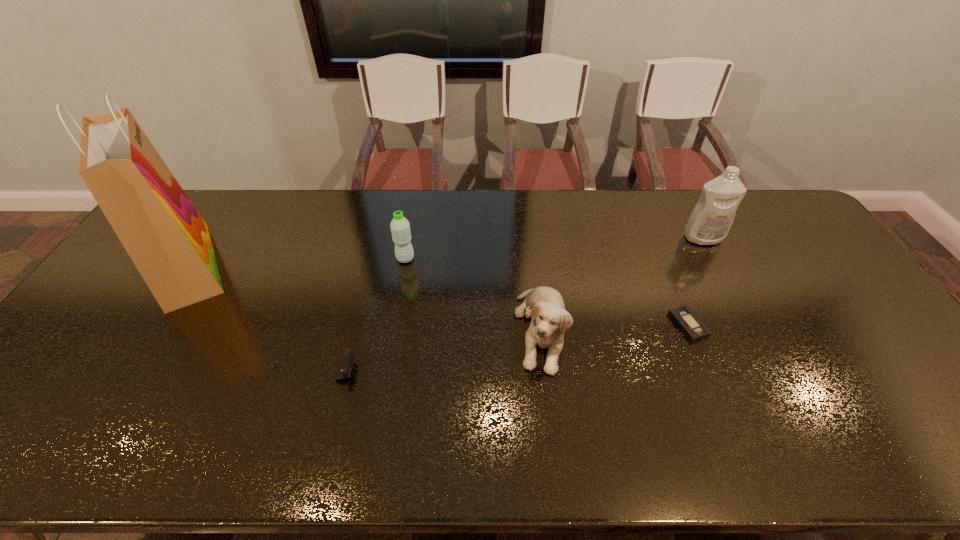
Identify the location of the fifth object from left to right. (684, 317).

Where is `the shortest object`? Image resolution: width=960 pixels, height=540 pixels. the shortest object is located at coordinates (684, 317).

You are a GUI agent. You are given a task and a screenshot of the screen. Output one action in this format:
    pyautogui.click(x=<x>, y=<y>)
    Task: Click on the vacant space located on the right of the tallest object
    The width and height of the screenshot is (960, 540).
    Given the screenshot: What is the action you would take?
    pyautogui.click(x=284, y=265)

The image size is (960, 540). I want to click on free point located on the right of the detergent, so click(x=789, y=238).

Locate an element on the screen. vacant space located 0.390m on the right of the third object from left to right is located at coordinates (539, 259).

I want to click on free point located 0.190m on the front-facing side of the fourth tallest object, so click(x=555, y=454).

The height and width of the screenshot is (540, 960). I want to click on free spot located on the front-facing side of the fifth object from right to left, so click(x=463, y=374).

Identify the location of vacant space positioned on the back of the second object from right to left. This screenshot has width=960, height=540. (656, 246).

Where is `shopping bag at the far edge`? shopping bag at the far edge is located at coordinates (168, 241).

Locate an element on the screen. The image size is (960, 540). detergent located in the far edge section of the desktop is located at coordinates (709, 223).